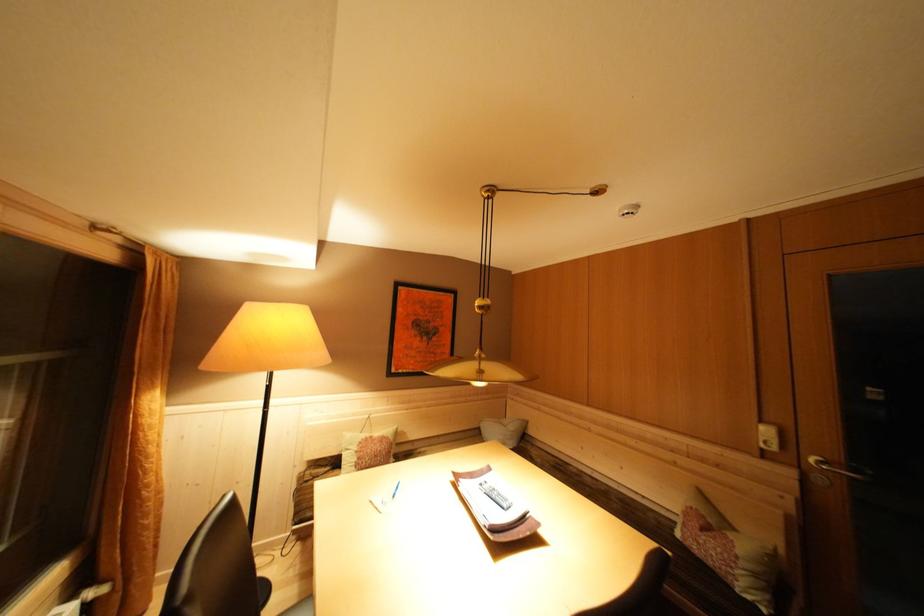
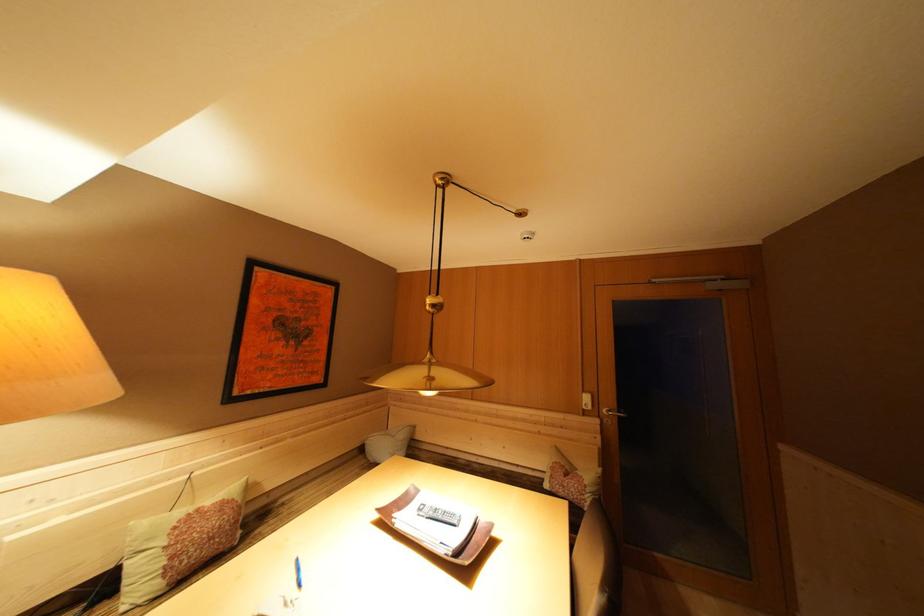
The point at (460, 477) is marked in the first image. Where is the corresponding point in the second image?

(384, 515)